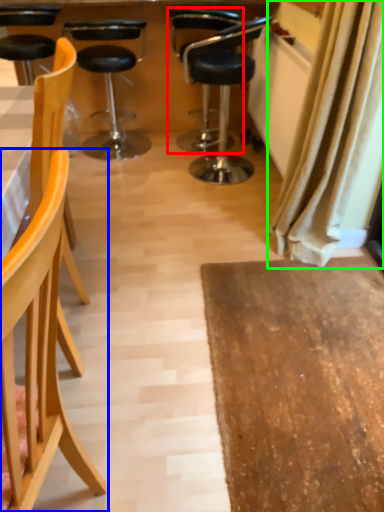
Question: Which is farther away from chair (highlighted by a red box)? chair (highlighted by a blue box) or curtain (highlighted by a green box)?

Choices:
 (A) chair
 (B) curtain

Answer: (A)